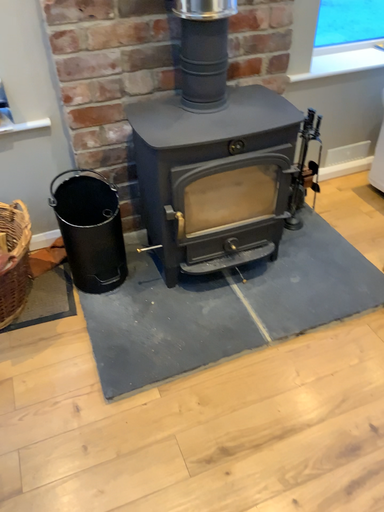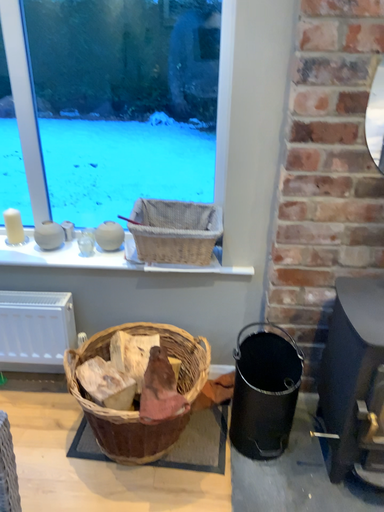
Question: Which way did the camera rotate in the video?

Choices:
 (A) rotated downward
 (B) rotated upward

Answer: (B)